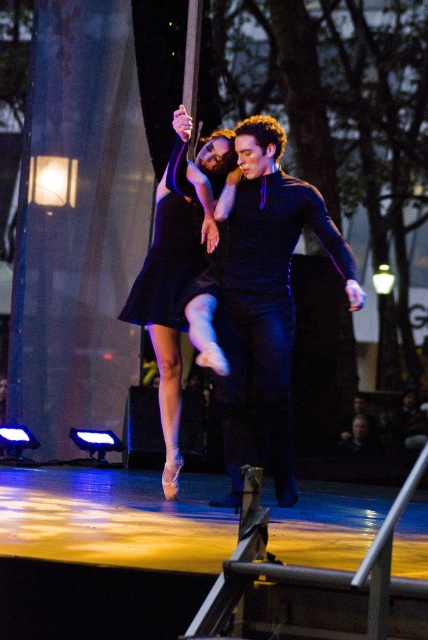
You are a photographer at the back of the stage. You want to capture a photo where both the dark blue sweater at center and the matte black dress at center are clearly visible in the frame. Given that your camera has a minimum focus distance of 15 inches, will you be able to focus on both subjects simultaneously?

The dark blue sweater at center is 16.07 inches from the matte black dress at center. Since the distance between them is greater than the camera minimum focus distance of 15 inches, the camera can focus on both subjects simultaneously.

You are a photographer at the back of the stage. You want to take a photo of both the matte black dress at center and the black satin dress at center. Since you have a camera with a limited depth of field, which dress should you focus on to ensure it appears sharp in the photo?

The matte black dress at center has a greater height compared to the black satin dress at center. Therefore, focusing on the matte black dress at center would ensure it appears sharp since it is closer to the camera.

You are a photographer at the back of the stage. You need to capture a photo where both the matte black dress at center and the black satin dress at center are visible. Which dress should you focus on first to ensure both are in frame?

The matte black dress at center is to the left of the black satin dress at center. Since you are at the back of the stage, focusing on the leftmost dress first will help ensure both are within the frame as you adjust your camera.